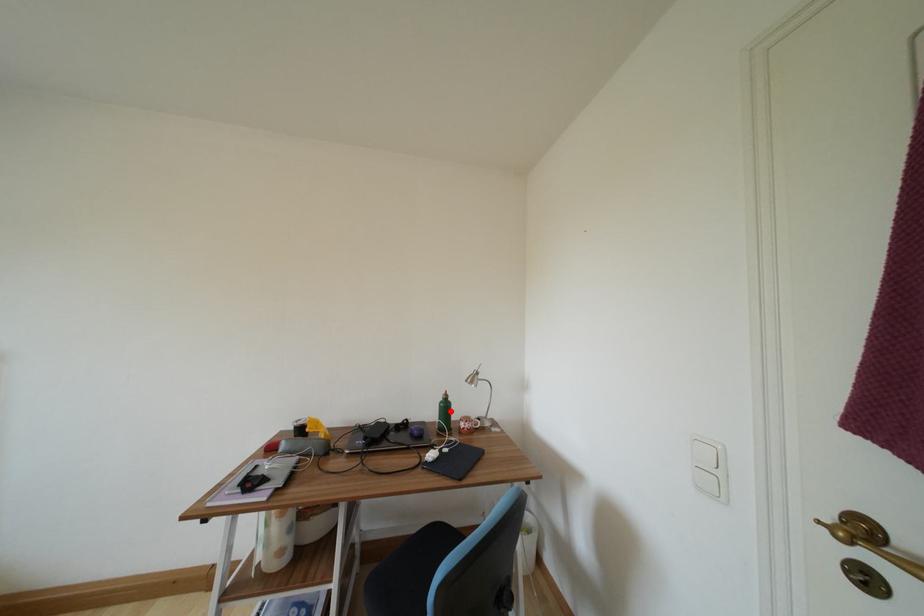
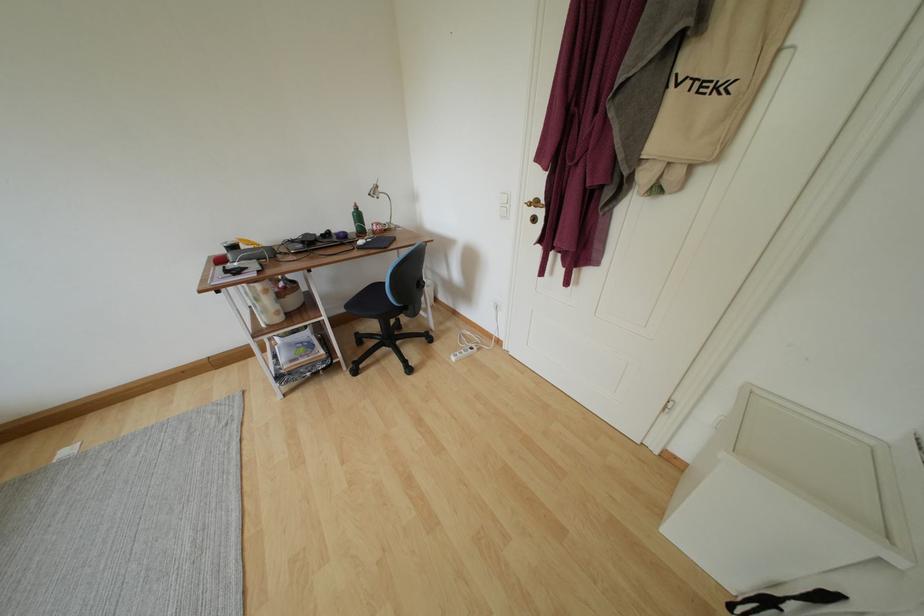
Question: A red point is marked in image1. In image2, is the corresponding 3D point closer to the camera or farther? Reply with the corresponding letter.

Choices:
 (A) The corresponding 3D point is closer.
 (B) The corresponding 3D point is farther.

Answer: (A)